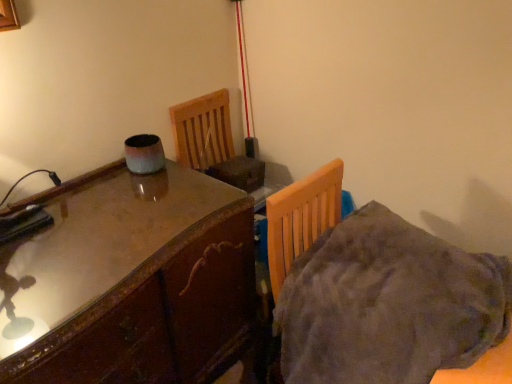
What do you see at coordinates (135, 282) in the screenshot?
I see `glossy wood table at left` at bounding box center [135, 282].

Locate an element on the screen. glossy wood table at left is located at coordinates (135, 282).

Where is `fuzzy gray blanket at lower right`? fuzzy gray blanket at lower right is located at coordinates (388, 304).

In order to face fuzzy gray blanket at lower right, should I rotate leftwards or rightwards?

A 18.915 degree turn to the right will do.

Image resolution: width=512 pixels, height=384 pixels. What do you see at coordinates (388, 304) in the screenshot? I see `fuzzy gray blanket at lower right` at bounding box center [388, 304].

Where is `glossy wood table at left`? The image size is (512, 384). glossy wood table at left is located at coordinates (135, 282).

Considering the relative positions of fuzzy gray blanket at lower right and glossy wood table at left in the image provided, is fuzzy gray blanket at lower right to the left or to the right of glossy wood table at left?

From the image, it's evident that fuzzy gray blanket at lower right is to the right of glossy wood table at left.

Between fuzzy gray blanket at lower right and glossy wood table at left, which one is positioned in front?

fuzzy gray blanket at lower right.

Is point (392, 216) less distant than point (156, 220)?

No, (392, 216) is further to viewer.

From the image's perspective, relative to glossy wood table at left, is fuzzy gray blanket at lower right above or below?

Based on their image positions, fuzzy gray blanket at lower right is located above glossy wood table at left.

Based on the photo, from a real-world perspective, who is located lower, fuzzy gray blanket at lower right or glossy wood table at left?

glossy wood table at left.

Considering the relative sizes of fuzzy gray blanket at lower right and glossy wood table at left in the image provided, is fuzzy gray blanket at lower right wider than glossy wood table at left?

In fact, fuzzy gray blanket at lower right might be narrower than glossy wood table at left.

From the picture: In terms of height, does fuzzy gray blanket at lower right look taller or shorter compared to glossy wood table at left?

fuzzy gray blanket at lower right is shorter than glossy wood table at left.

Which of these two, fuzzy gray blanket at lower right or glossy wood table at left, is bigger?

glossy wood table at left is bigger.

Is glossy wood table at left surrounded by fuzzy gray blanket at lower right?

That's incorrect, glossy wood table at left is not inside fuzzy gray blanket at lower right.

Would you consider fuzzy gray blanket at lower right to be distant from glossy wood table at left?

That's not correct — fuzzy gray blanket at lower right is a little close to glossy wood table at left.

Is fuzzy gray blanket at lower right facing away from glossy wood table at left?

No.

At what (x,y) coordinates should I click in order to perform the action: click on table that is below the fuzzy gray blanket at lower right (from the image's perspective). Please return your answer as a coordinate pair (x, y). Looking at the image, I should click on (135, 282).

Between glossy wood table at left and fuzzy gray blanket at lower right, which one appears on the right side from the viewer's perspective?

fuzzy gray blanket at lower right is more to the right.

Which is in front, glossy wood table at left or fuzzy gray blanket at lower right?

fuzzy gray blanket at lower right is in front.

Which is behind, point (199, 222) or point (322, 333)?

Point (199, 222)

From the image's perspective, which is below, glossy wood table at left or fuzzy gray blanket at lower right?

From the image's view, glossy wood table at left is below.

From a real-world perspective, between glossy wood table at left and fuzzy gray blanket at lower right, who is vertically lower?

glossy wood table at left is physically lower.

Is glossy wood table at left wider than fuzzy gray blanket at lower right?

Yes, glossy wood table at left is wider than fuzzy gray blanket at lower right.

Consider the image. Can you confirm if glossy wood table at left is shorter than fuzzy gray blanket at lower right?

In fact, glossy wood table at left may be taller than fuzzy gray blanket at lower right.

From the picture: Does glossy wood table at left have a larger size compared to fuzzy gray blanket at lower right?

Yes.

From the picture: Is fuzzy gray blanket at lower right inside glossy wood table at left?

No.

Is glossy wood table at left far away from fuzzy gray blanket at lower right?

Actually, glossy wood table at left and fuzzy gray blanket at lower right are a little close together.

Could you tell me if glossy wood table at left is turned towards fuzzy gray blanket at lower right?

Yes, glossy wood table at left is aimed at fuzzy gray blanket at lower right.

How different are the orientations of glossy wood table at left and fuzzy gray blanket at lower right in degrees?

They differ by 7.31 degrees in their facing directions.

Locate an element on the screen. blanket in front of the glossy wood table at left is located at coordinates (388, 304).

This screenshot has width=512, height=384. In order to click on blanket lying on the right of glossy wood table at left in this screenshot , I will do `click(388, 304)`.

This screenshot has width=512, height=384. In order to click on table lying on the left of fuzzy gray blanket at lower right in this screenshot , I will do `click(135, 282)`.